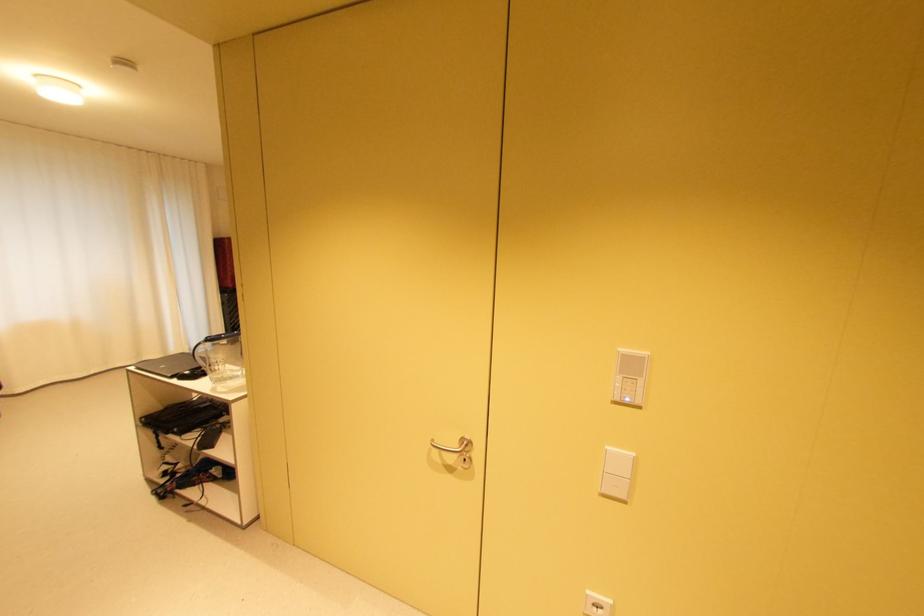
The image size is (924, 616). Identify the location of white power outlet. (597, 604).